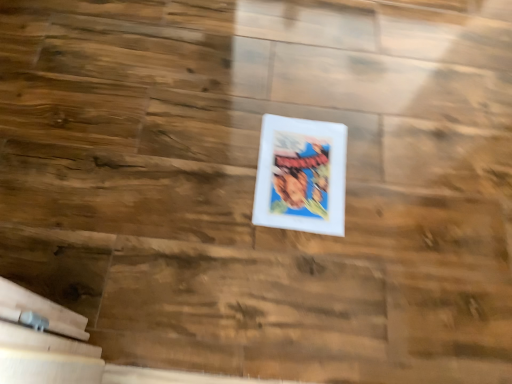
Find the location of a particular element. The image size is (512, 384). vacant area on top of white matte picture frame at center (from a real-world perspective) is located at coordinates (302, 172).